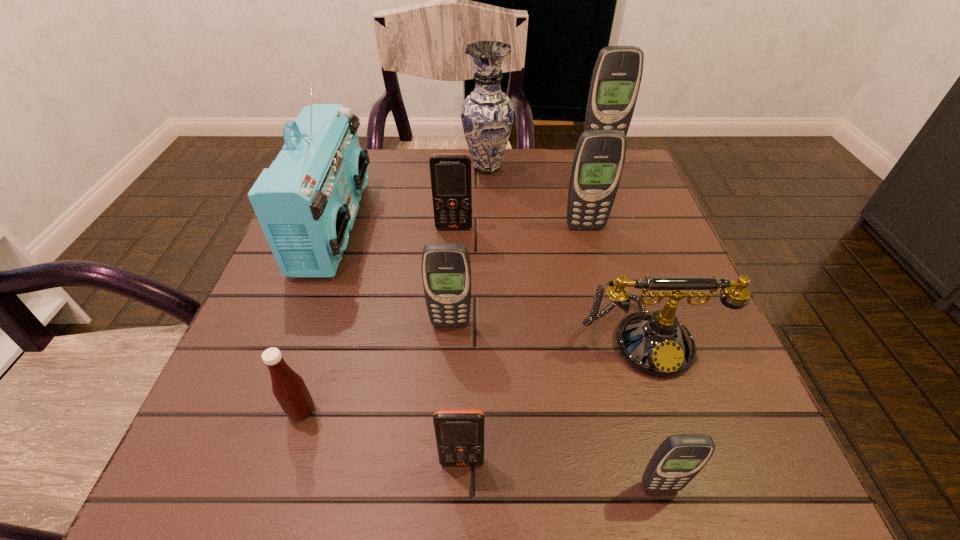
The image size is (960, 540). In order to click on object at the far left corner in this screenshot , I will do coord(306,202).

The width and height of the screenshot is (960, 540). I want to click on object present at the far right corner, so click(616, 78).

Find the location of a particular element. object that is at the near right corner is located at coordinates (679, 458).

Locate an element on the screen. free space at the far edge of the desktop is located at coordinates (552, 169).

You are a GUI agent. You are given a task and a screenshot of the screen. Output one action in this format:
    pyautogui.click(x=<x>, y=<y>)
    Task: Click on the vacant region at the near edge of the desktop
    
    Given the screenshot: What is the action you would take?
    pyautogui.click(x=368, y=494)

You are a GUI agent. You are given a task and a screenshot of the screen. Output one action in this format:
    pyautogui.click(x=<x>, y=<y>)
    Task: Click on the vacant space at the left edge
    The width and height of the screenshot is (960, 540).
    Given the screenshot: What is the action you would take?
    (279, 309)

Where is `vacant space at the right edge`? Image resolution: width=960 pixels, height=540 pixels. vacant space at the right edge is located at coordinates (652, 210).

The image size is (960, 540). Find the location of `vacant position at the near right corner of the desktop`. vacant position at the near right corner of the desktop is located at coordinates (767, 500).

This screenshot has width=960, height=540. I want to click on free space that is in between the nearest gray cellular telephone and the telephone, so click(653, 412).

Locate an element on the screen. This screenshot has height=540, width=960. blank region between the nearest object and the second nearest gray cellular telephone is located at coordinates (555, 405).